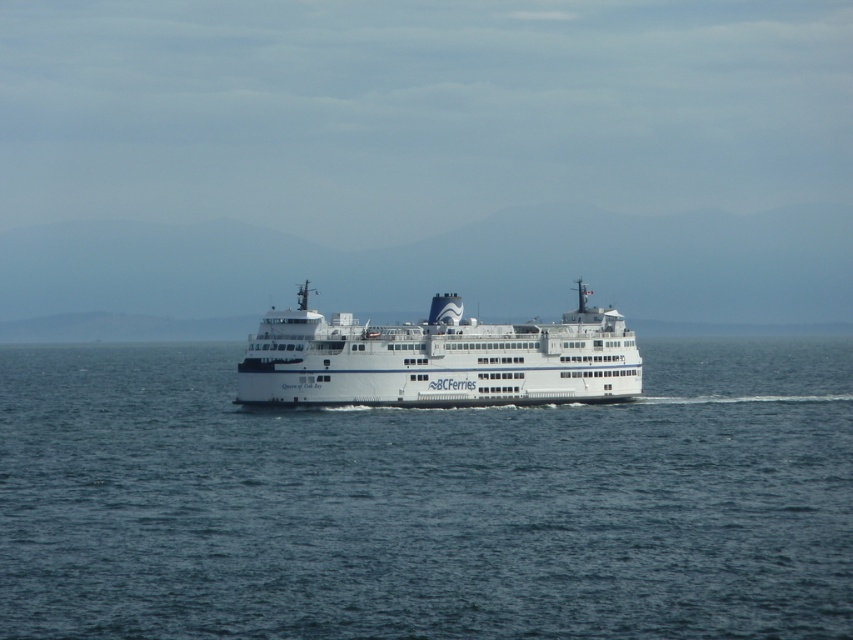
You are a photographer trying to capture the white matte ferry at center from the shore. You notice the blue water at center in the background. Which one is wider in the image?

The blue water at center is wider than the white matte ferry at center in the image.

You are a passenger on the ferry and want to see the blue water at center. Where should you look from your position on the white matte ferry at center?

The blue water at center is positioned under the white matte ferry at center, so you should look downward from the ferry to see it.